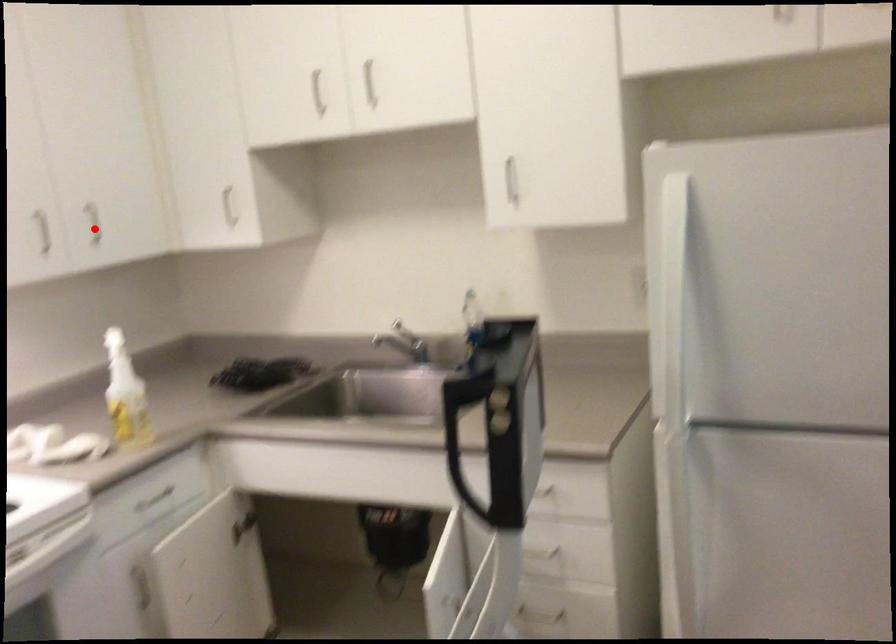
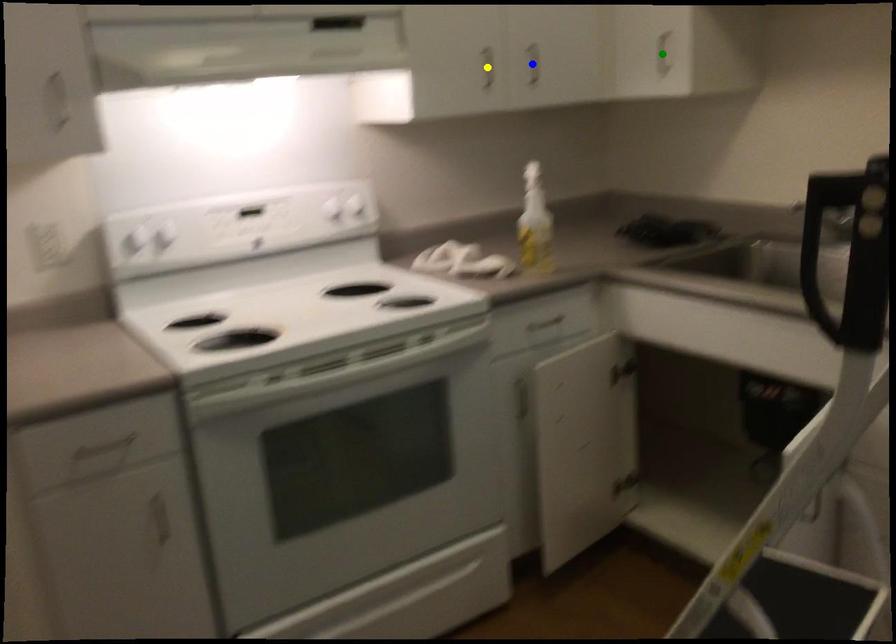
Question: I am providing you with two images of the same scene from different viewpoints. A red point is marked on the first image. You are given multiple points on the second image. Which point in image 2 is actually the same real-world point as the red point in image 1?

Choices:
 (A) green point
 (B) blue point
 (C) yellow point

Answer: (B)